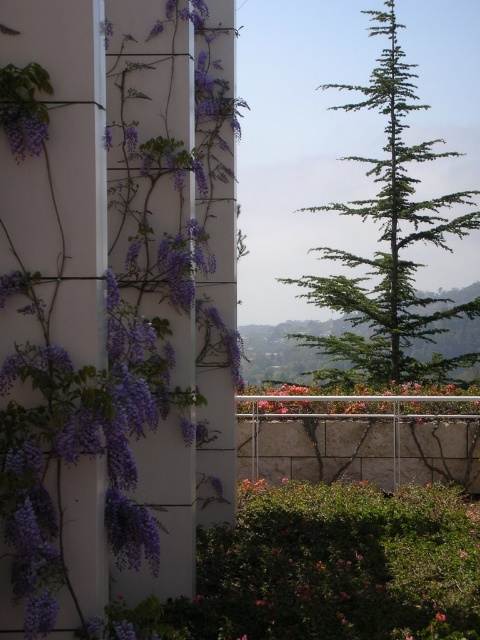
Question: Does purple matte flowers at left have a lesser width compared to pink matte flowers at center?

Choices:
 (A) yes
 (B) no

Answer: (A)

Question: Does green needle-like tree at right appear on the left side of purple matte flower at upper left?

Choices:
 (A) yes
 (B) no

Answer: (B)

Question: Among these points, which one is nearest to the camera?

Choices:
 (A) (398, 84)
 (B) (440, 611)
 (C) (204, 456)

Answer: (B)

Question: In this image, where is purple matte flowers at left located relative to purple matte flower at upper left?

Choices:
 (A) left
 (B) right

Answer: (A)

Question: Which of the following is the closest to the observer?

Choices:
 (A) pink matte flowers at center
 (B) purple matte flowers at left
 (C) green needle-like tree at right
 (D) purple matte flower at upper left

Answer: (D)

Question: Which object is closer to the camera taking this photo?

Choices:
 (A) purple matte flower at upper left
 (B) pink matte flowers at center

Answer: (A)